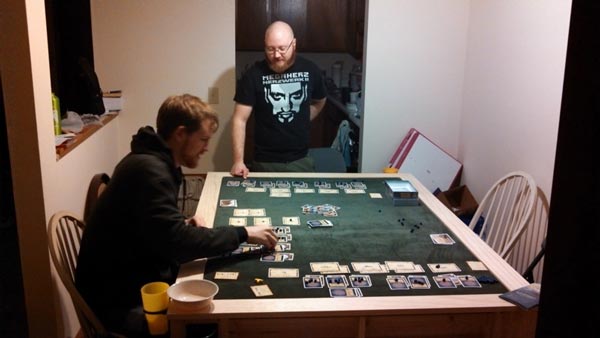
The image size is (600, 338). I want to click on cup, so click(151, 299).